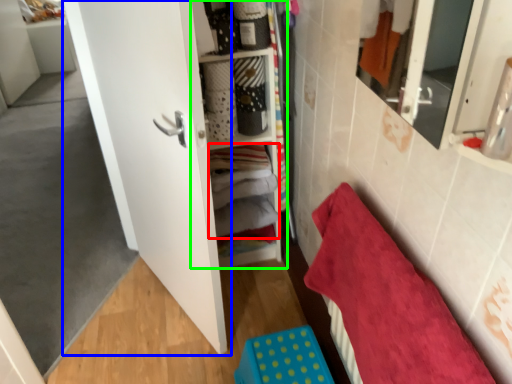
Question: Considering the real-world distances, which object is closest to laundry (highlighted by a red box)? door (highlighted by a blue box) or cabinet (highlighted by a green box).

Choices:
 (A) door
 (B) cabinet

Answer: (B)